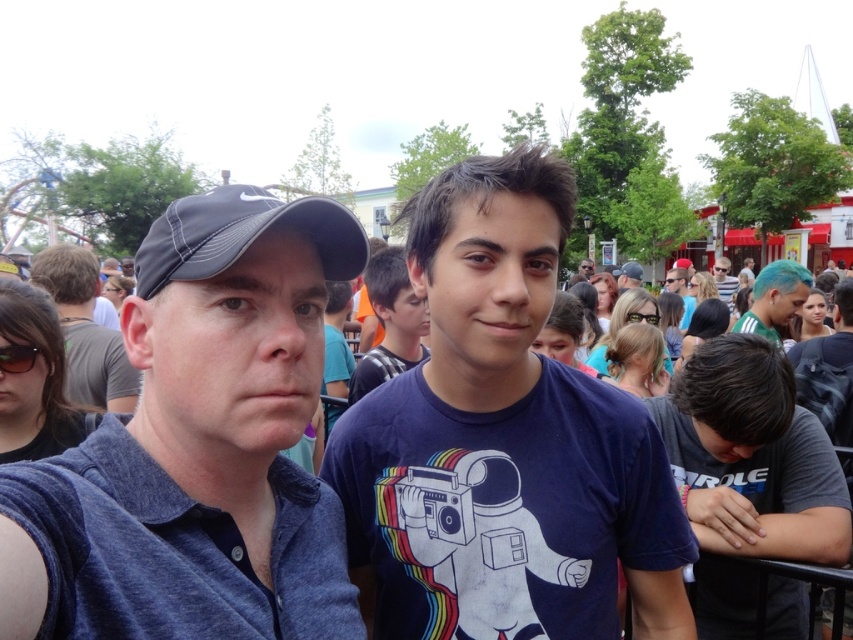
You are standing at the front of the scene and want to take a photo of both the teal hair at upper right and the matte black shirt at upper center. Which object should you focus on first to ensure both are in the frame?

You should focus on the teal hair at upper right first because it is closer to the viewer than the matte black shirt at upper center, so adjusting the camera to include both would require starting with the closer object.

You are a photographer at the event and want to ensure both the dark blue fabric shirt at left and the matte blue shirt at center are fully visible in your photo. Which of the two requires you to adjust your camera angle to avoid being cut off?

The matte blue shirt at center is taller than the dark blue fabric shirt at left, so you should adjust your camera angle to ensure the taller matte blue shirt at center is fully visible without being cut off.